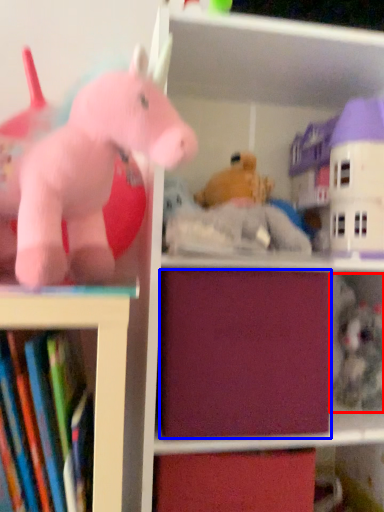
Question: Which of the following is the closest to the observer, toy (highlighted by a red box) or drawer (highlighted by a blue box)?

Choices:
 (A) toy
 (B) drawer

Answer: (B)